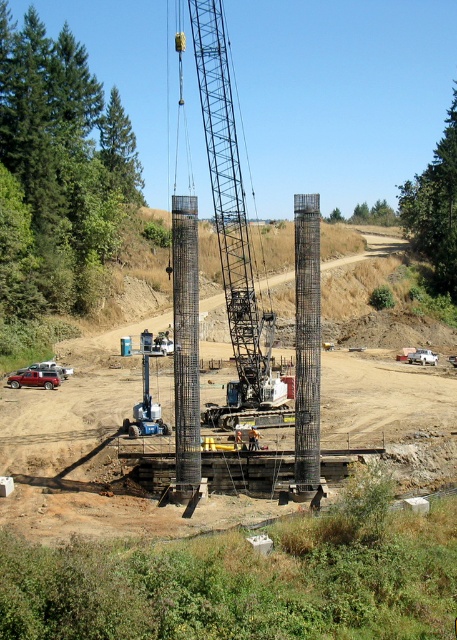
Is point (363, 236) positioned behind point (295, 282)?

Yes, it is behind point (295, 282).

Between smooth concrete pillars at center and metallic grid column at center, which one appears on the left side from the viewer's perspective?

From the viewer's perspective, smooth concrete pillars at center appears more on the left side.

Who is more forward, (219, 435) or (315, 355)?

Point (315, 355)

Where is `smooth concrete pillars at center`? The width and height of the screenshot is (457, 640). smooth concrete pillars at center is located at coordinates (94, 460).

Between smooth concrete pillars at center and orange safety vest at center, which one is positioned lower?

Positioned lower is orange safety vest at center.

Can you confirm if smooth concrete pillars at center is taller than orange safety vest at center?

Indeed, smooth concrete pillars at center has a greater height compared to orange safety vest at center.

The height and width of the screenshot is (640, 457). What are the coordinates of `smooth concrete pillars at center` in the screenshot? It's located at point(94,460).

The width and height of the screenshot is (457, 640). Find the location of `smooth concrete pillars at center`. smooth concrete pillars at center is located at coordinates (94, 460).

Can you confirm if smooth concrete pillars at center is bigger than metallic gray crane at center?

No.

Is smooth concrete pillars at center wider than metallic gray crane at center?

Yes.

Find the location of a particular element. The image size is (457, 640). smooth concrete pillars at center is located at coordinates (94, 460).

Where is `smooth concrete pillars at center`? The image size is (457, 640). smooth concrete pillars at center is located at coordinates (94, 460).